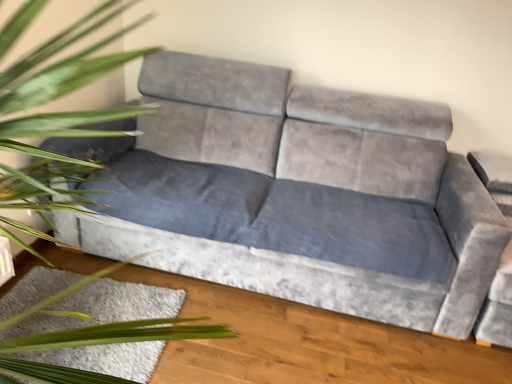
Question: Can you confirm if velvet grey couch at center is smaller than green leafy plant at left?

Choices:
 (A) no
 (B) yes

Answer: (A)

Question: Is velvet grey couch at center oriented away from green leafy plant at left?

Choices:
 (A) yes
 (B) no

Answer: (B)

Question: From a real-world perspective, does velvet grey couch at center stand above green leafy plant at left?

Choices:
 (A) yes
 (B) no

Answer: (B)

Question: Is velvet grey couch at center far from green leafy plant at left?

Choices:
 (A) no
 (B) yes

Answer: (B)

Question: From a real-world perspective, is velvet grey couch at center physically below green leafy plant at left?

Choices:
 (A) yes
 (B) no

Answer: (A)

Question: Is velvet grey couch at center beside green leafy plant at left?

Choices:
 (A) yes
 (B) no

Answer: (B)

Question: Considering the relative sizes of white shaggy rug at lower left and green leafy plant at left in the image provided, is white shaggy rug at lower left taller than green leafy plant at left?

Choices:
 (A) yes
 (B) no

Answer: (B)

Question: Can you see white shaggy rug at lower left touching green leafy plant at left?

Choices:
 (A) yes
 (B) no

Answer: (B)

Question: Does white shaggy rug at lower left have a lesser width compared to green leafy plant at left?

Choices:
 (A) yes
 (B) no

Answer: (A)

Question: Is white shaggy rug at lower left closer to camera compared to green leafy plant at left?

Choices:
 (A) yes
 (B) no

Answer: (B)

Question: From a real-world perspective, is white shaggy rug at lower left on green leafy plant at left?

Choices:
 (A) no
 (B) yes

Answer: (A)

Question: Is white shaggy rug at lower left further to the viewer compared to green leafy plant at left?

Choices:
 (A) no
 (B) yes

Answer: (B)

Question: Is green leafy plant at left oriented away from velvet grey couch at center?

Choices:
 (A) yes
 (B) no

Answer: (B)